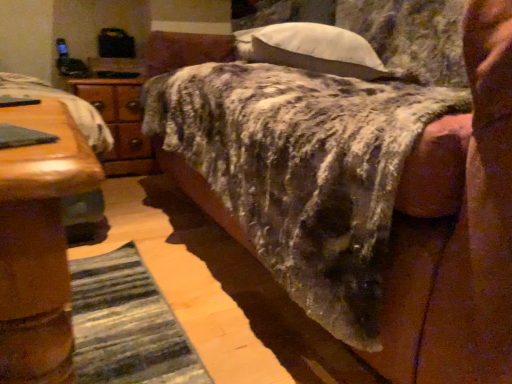
Question: Considering the positions of textured wool blanket at center and white soft pillow at upper center in the image, is textured wool blanket at center taller or shorter than white soft pillow at upper center?

Choices:
 (A) tall
 (B) short

Answer: (A)

Question: From the image's perspective, is textured wool blanket at center located above or below white soft pillow at upper center?

Choices:
 (A) above
 (B) below

Answer: (B)

Question: Based on their relative distances, which object is nearer to the textured wool blanket at center?

Choices:
 (A) white soft pillow at upper center
 (B) wooden nightstand at left

Answer: (A)

Question: Based on their relative distances, which object is nearer to the white soft pillow at upper center?

Choices:
 (A) textured wool blanket at center
 (B) wooden nightstand at left

Answer: (A)